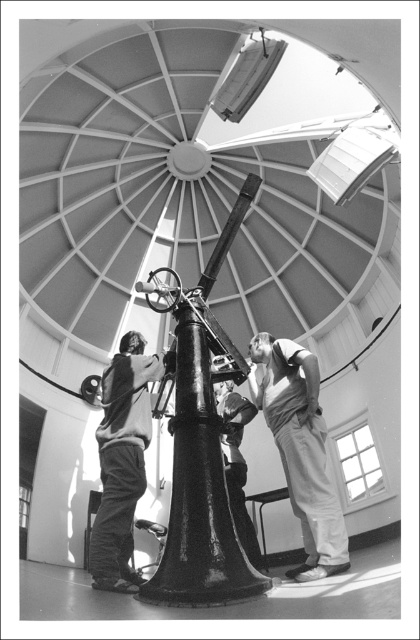
Question: Which object is farther from the camera taking this photo?

Choices:
 (A) light gray cotton pants at lower right
 (B) matte black clothing at center
 (C) smooth fabric shirt at center
 (D) polished metal telescope at center

Answer: (C)

Question: Is light gray cotton pants at lower right bigger than matte black clothing at center?

Choices:
 (A) yes
 (B) no

Answer: (B)

Question: Can you confirm if polished metal telescope at center is positioned to the left of smooth fabric shirt at center?

Choices:
 (A) no
 (B) yes

Answer: (B)

Question: Does polished metal telescope at center come behind light gray cotton pants at lower right?

Choices:
 (A) no
 (B) yes

Answer: (A)

Question: Among these objects, which one is farthest from the camera?

Choices:
 (A) polished metal telescope at center
 (B) matte black clothing at center
 (C) light gray cotton pants at lower right
 (D) smooth fabric shirt at center

Answer: (D)

Question: Which of the following is the closest to the observer?

Choices:
 (A) (307, 371)
 (B) (241, 490)
 (C) (112, 396)

Answer: (A)